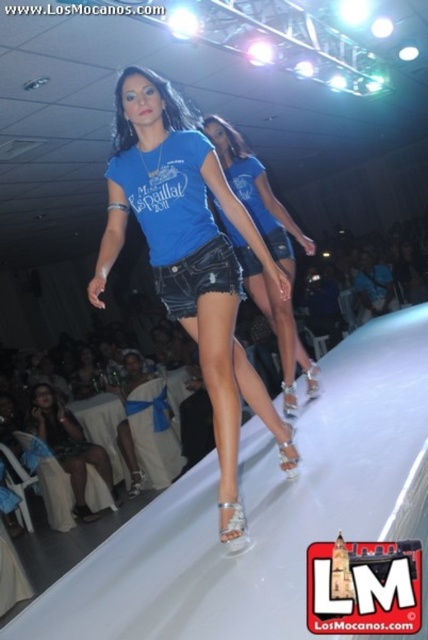
You are a photographer at the fashion show. You need to capture a photo of both the blue denim shorts at center and the matte black dress at lower left. Which one should you zoom in on to ensure it fills the frame better?

The blue denim shorts at center is bigger than the matte black dress at lower left, so you should zoom in on the blue denim shorts at center to ensure it fills the frame better.

You are a photographer at the fashion show. You need to capture a closeup shot of the matte black dress at lower left and the denim shorts at center. Which item should you zoom in on more to ensure both are in frame?

The matte black dress at lower left is larger in size than the denim shorts at center, so you should zoom in more on the denim shorts at center to ensure both are in frame.